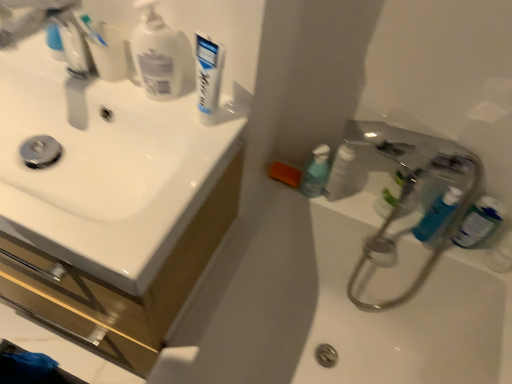
Find the location of a particular element. The image size is (512, 384). free location to the right of blue glossy mouthwash at lower right, marked as the first mouthwash in a left-to-right arrangement is located at coordinates pos(361,204).